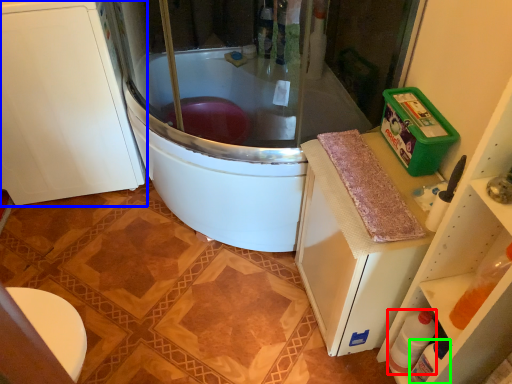
Question: Which object is the farthest from bottle (highlighted by a red box)? Choose among these: cabinetry (highlighted by a blue box) or bottle (highlighted by a green box).

Choices:
 (A) cabinetry
 (B) bottle

Answer: (A)